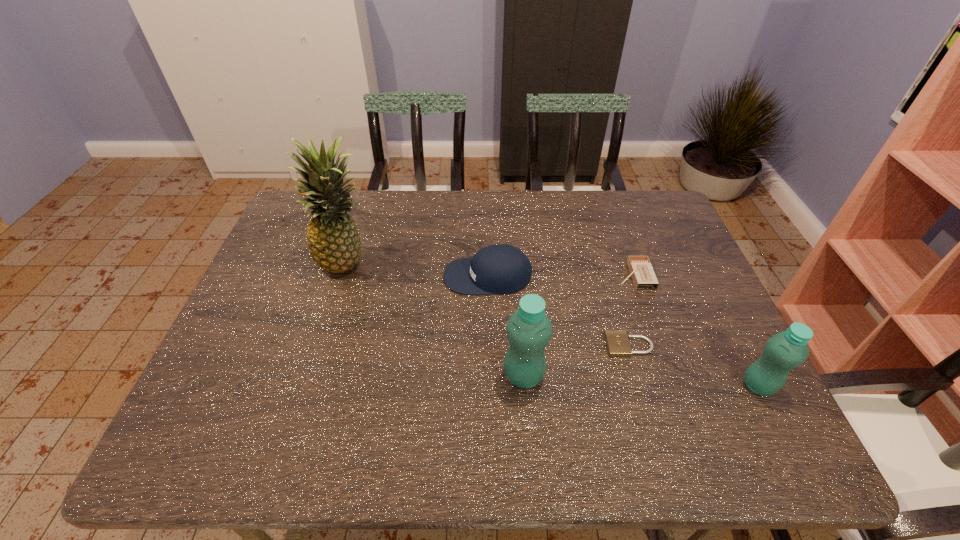
Please point a free position for a water bottle on the left. Please provide its 2D coordinates. Your answer should be formatted as a tuple, i.e. [(x, y)], where the tuple contains the x and y coordinates of a point satisfying the conditions above.

[(298, 366)]